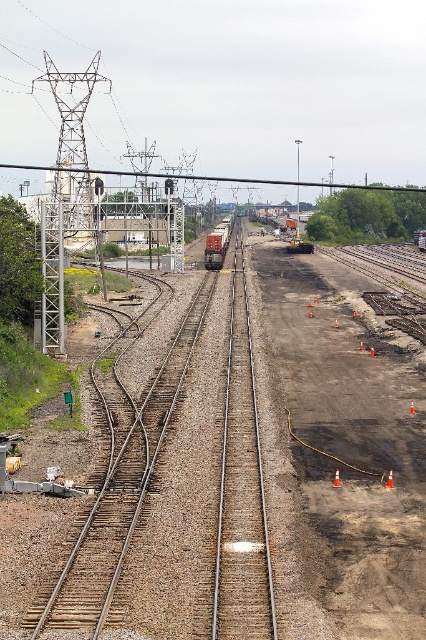
You are a railway worker standing at the center of the tracks. You see a black wire at center and an orange traffic cone at center. Which object is closer to your left side?

The black wire at center is to the left of orange traffic cone at center, so the black wire at center is closer to your left side.